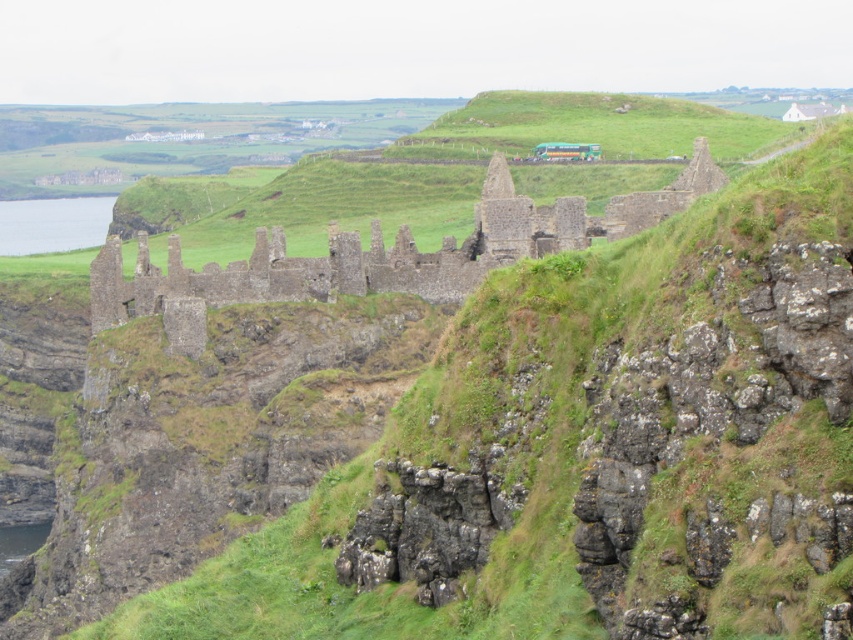
Question: Does rustic stone ruins at center appear on the left side of clear blue water at left?

Choices:
 (A) no
 (B) yes

Answer: (A)

Question: Among these points, which one is farthest from the camera?

Choices:
 (A) (183, 310)
 (B) (39, 225)

Answer: (B)

Question: Can you confirm if rustic stone ruins at center is positioned to the right of clear blue water at left?

Choices:
 (A) no
 (B) yes

Answer: (B)

Question: Can you confirm if rustic stone ruins at center is positioned to the left of clear blue water at left?

Choices:
 (A) no
 (B) yes

Answer: (A)

Question: Which point is closer to the camera taking this photo?

Choices:
 (A) (30, 202)
 (B) (498, 221)

Answer: (B)